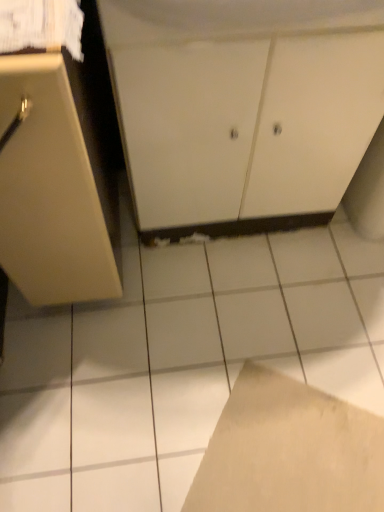
Find the location of a particular element. Image resolution: width=384 pixels, height=512 pixels. empty space that is ontop of brown cardboard at lower center is located at coordinates (289, 461).